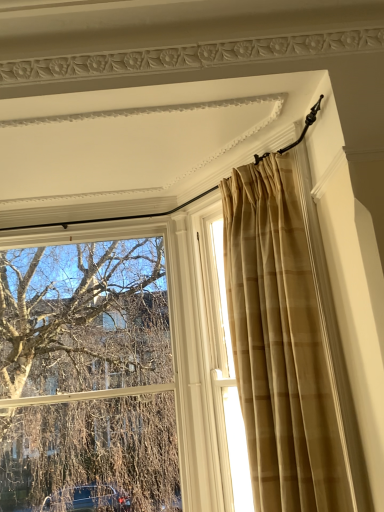
Question: Considering the positions of clear glass window at upper left, placed as the first window when sorted from left to right, and beige plaid curtain at upper right in the image, is clear glass window at upper left, placed as the first window when sorted from left to right, wider or thinner than beige plaid curtain at upper right?

Choices:
 (A) thin
 (B) wide

Answer: (A)

Question: From a real-world perspective, is clear glass window at upper left, placed as the first window when sorted from left to right, positioned above or below beige plaid curtain at upper right?

Choices:
 (A) below
 (B) above

Answer: (A)

Question: Which of these objects is positioned farthest from the beige plaid curtain at upper right?

Choices:
 (A) clear glass window at upper left, placed as the first window when sorted from left to right
 (B) beige textured curtain at right, the 2th window viewed from the left

Answer: (A)

Question: Which object is positioned farthest from the clear glass window at upper left, placed as the first window when sorted from left to right?

Choices:
 (A) beige plaid curtain at upper right
 (B) beige textured curtain at right, which is counted as the first window, starting from the right

Answer: (A)